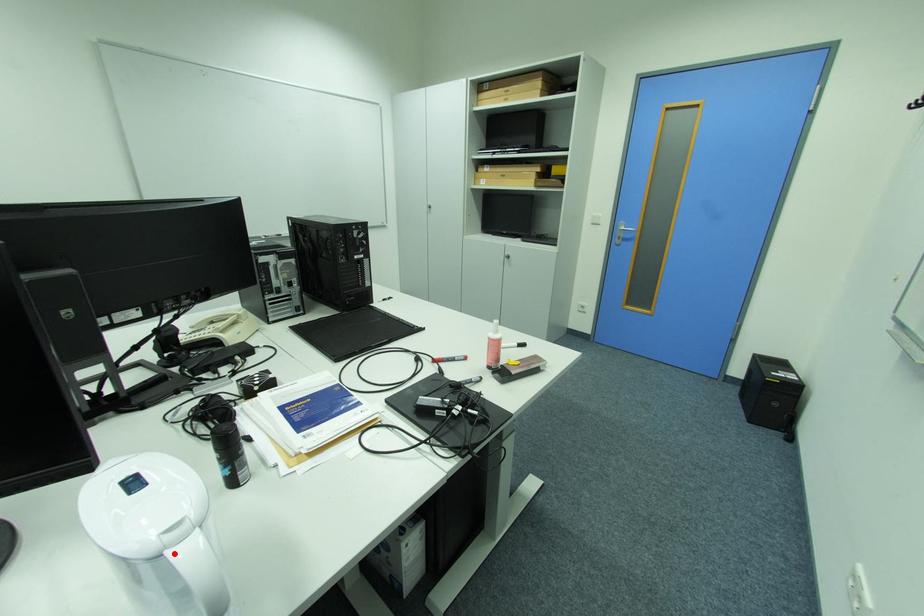
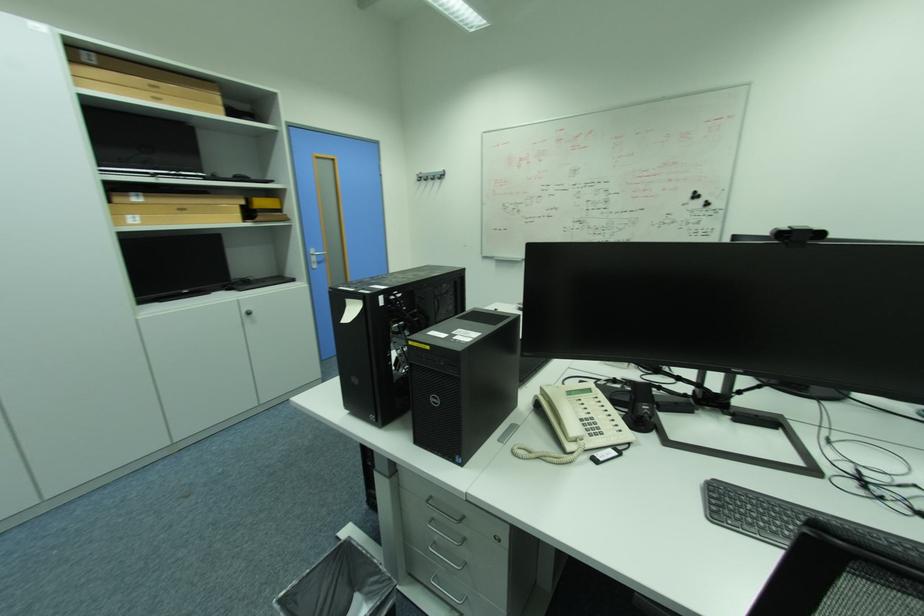
Question: I am providing you with two images of the same scene from different viewpoints. A red point is marked on the first image. Can you still see the location of the red point in image 2?

Choices:
 (A) Yes
 (B) No

Answer: (B)